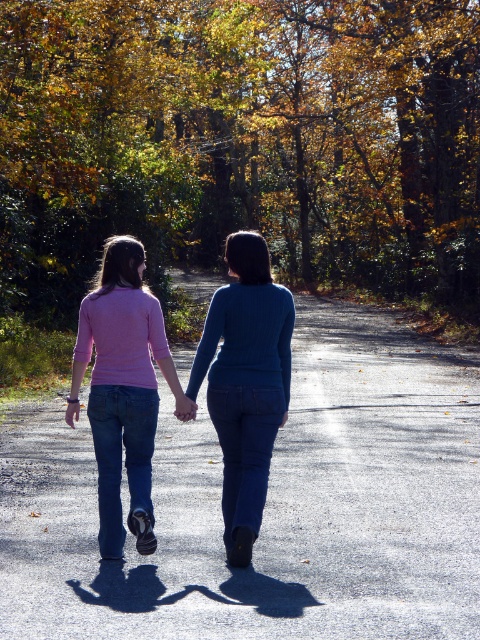
Who is lower down, asphalt road at center or blue denim jeans at center?

Positioned lower is asphalt road at center.

Between asphalt road at center and blue denim jeans at center, which one is positioned higher?

Positioned higher is blue denim jeans at center.

At what (x,y) coordinates should I click in order to perform the action: click on asphalt road at center. Please return your answer as a coordinate pair (x, y). This screenshot has width=480, height=640. Looking at the image, I should click on (267, 506).

Based on the photo, can you confirm if autumn leaves at center is taller than pink matte sweater at center?

Yes, autumn leaves at center is taller than pink matte sweater at center.

Does autumn leaves at center lie in front of pink matte sweater at center?

That is False.

Locate an element on the screen. autumn leaves at center is located at coordinates (240, 140).

Which of these two, asphalt road at center or pink matte sweater at center, stands shorter?

Standing shorter between the two is asphalt road at center.

Does asphalt road at center appear under pink matte sweater at center?

Yes.

Locate an element on the screen. asphalt road at center is located at coordinates (267, 506).